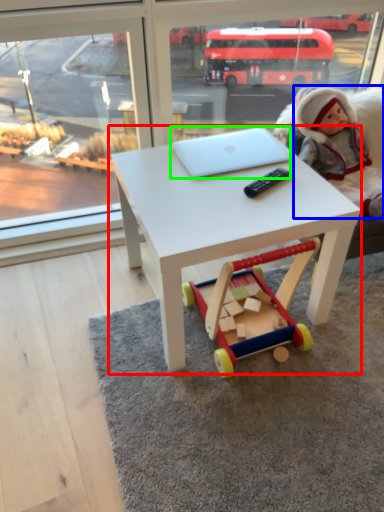
Question: Which is farther away from table (highlighted by a red box)? person (highlighted by a blue box) or laptop (highlighted by a green box)?

Choices:
 (A) person
 (B) laptop

Answer: (A)